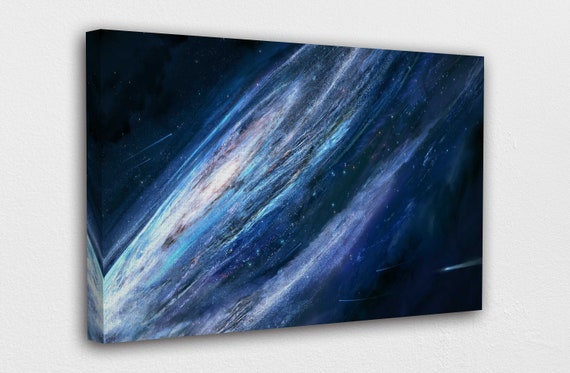
The width and height of the screenshot is (570, 373). Identify the location of wall texture. (494, 331), (13, 301), (35, 23).